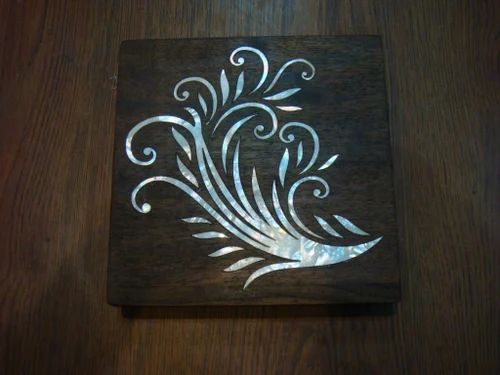
The image size is (500, 375). In order to click on brown block on top of table in this screenshot , I will do `click(364, 275)`, `click(343, 67)`, `click(157, 259)`.